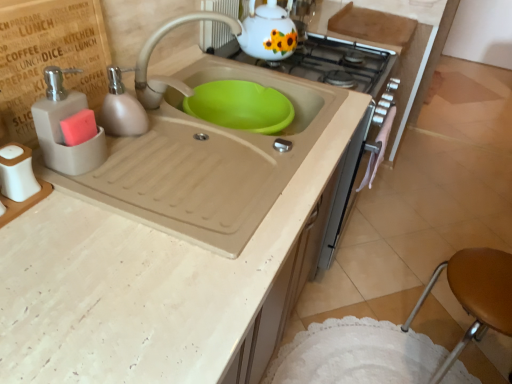
I want to click on free space to the right of matte gray soap dispenser at left, which appears as the 1th soap dispenser when viewed from the front, so click(161, 172).